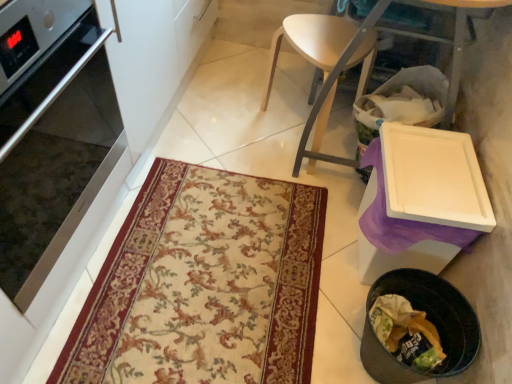
Locate an element on the screen. Image resolution: width=512 pixels, height=384 pixels. vacant area on the back side of beige floral rug at center is located at coordinates (254, 120).